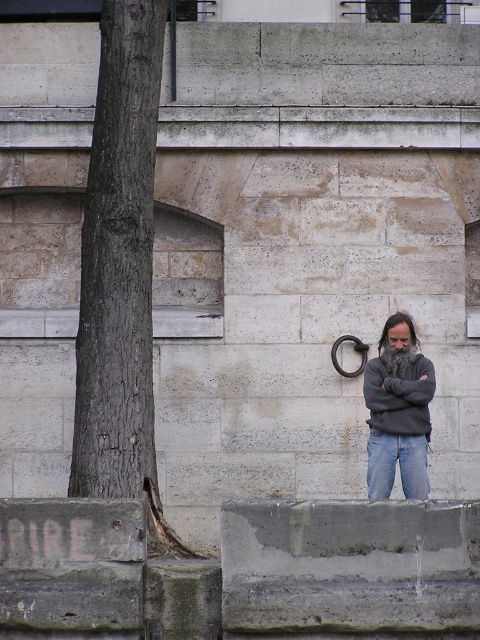
Does brown rough bark tree at left appear on the right side of gray sweater at center?

No, brown rough bark tree at left is not to the right of gray sweater at center.

Is brown rough bark tree at left to the left of gray sweater at center from the viewer's perspective?

Indeed, brown rough bark tree at left is positioned on the left side of gray sweater at center.

Identify the location of brown rough bark tree at left. (119, 260).

Measure the distance from gray sweater at center to denim jeans at lower center.

gray sweater at center is 8.64 inches away from denim jeans at lower center.

Is gray sweater at center further to the viewer compared to denim jeans at lower center?

No.

Between point (382, 340) and point (382, 496), which one is positioned behind?

The point (382, 340) is behind.

Image resolution: width=480 pixels, height=640 pixels. In order to click on gray sweater at center in this screenshot , I will do `click(397, 412)`.

Does point (132, 136) lie in front of point (380, 493)?

Yes, it is in front of point (380, 493).

Can you confirm if brown rough bark tree at left is positioned above denim jeans at lower center?

Indeed, brown rough bark tree at left is positioned over denim jeans at lower center.

Between point (112, 257) and point (396, 438), which one is positioned in front?

Point (112, 257) is in front.

Locate an element on the screen. This screenshot has width=480, height=640. brown rough bark tree at left is located at coordinates (119, 260).